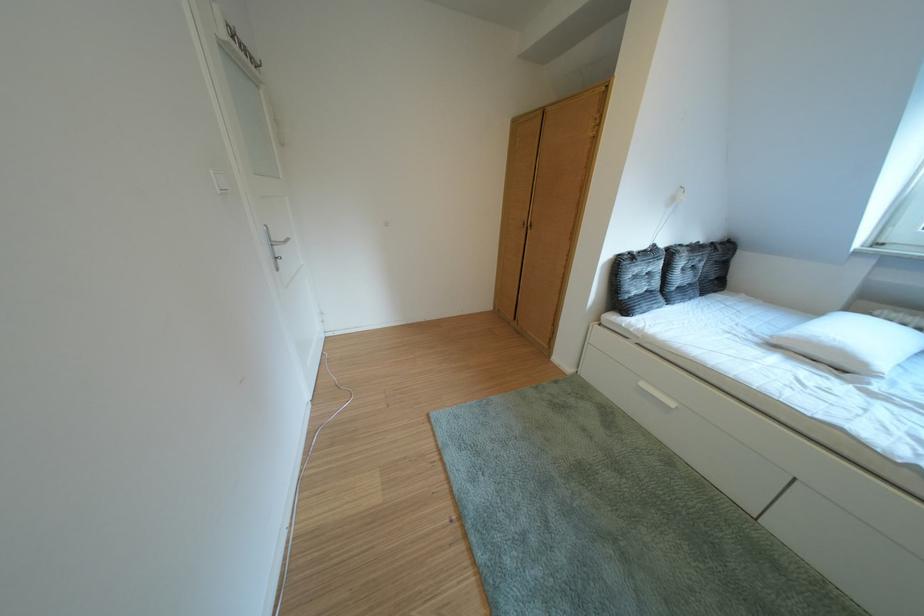
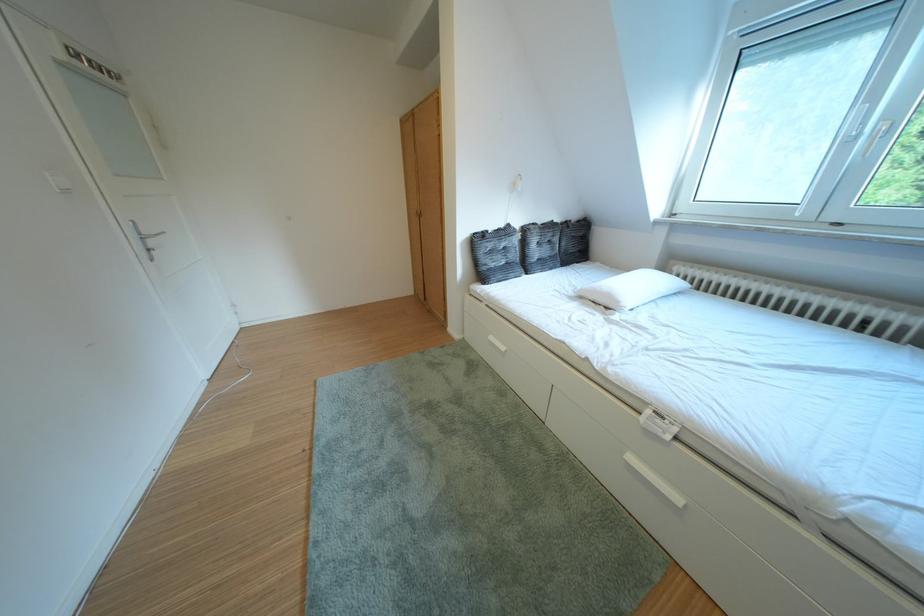
In the second image, find the point that corresponds to (857,358) in the first image.

(623, 301)